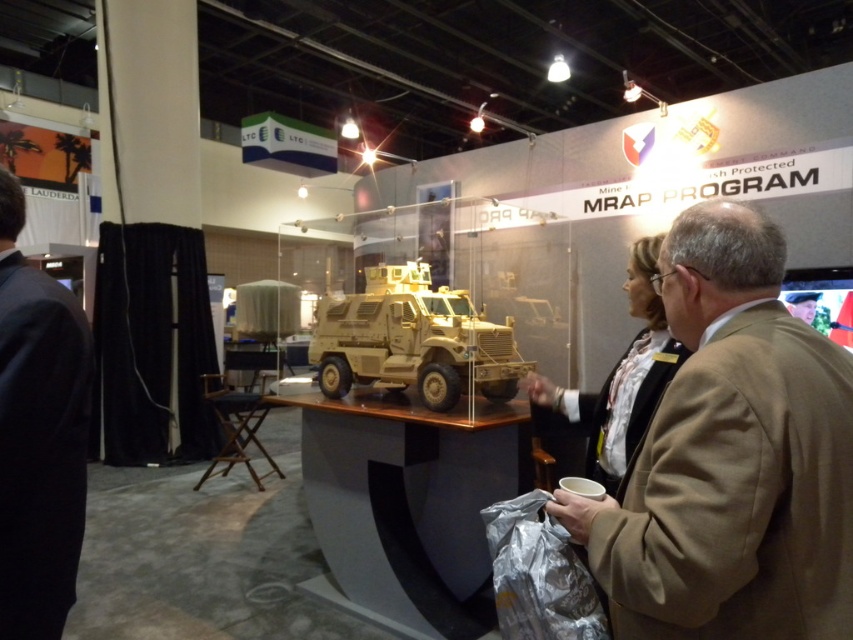
You are standing at the camera position and want to reach point (817,444). If your stride length is 28 inches, how many steps do you need to take to reach that point?

The distance between the camera and point (817,444) is 36.07 inches. Since each step covers 28 inches, you would need to take 2 steps to cover the distance, as 2 steps would cover 56 inches, which is more than enough. However, since you can adjust your last step to land precisely, you can reach the point in 2 steps.

You are an event organizer at the exhibition. You need to rearrange the seating area between the tan fabric suit at right and the black suit at left. Which person should you move first to accommodate more guests?

The tan fabric suit at right occupies less space than the black suit at left, so you should move the black suit at left first to accommodate more guests since it takes up more room.

You are a photographer at the exhibition. You want to take a photo of the black suit at left and the tan matte mrap at center so that both are fully visible. Given their height difference, which object should you position closer to the camera to ensure both are visible without cropping?

The black suit at left is much taller than the tan matte mrap at center. To ensure both are fully visible in the photo, position the black suit at left closer to the camera so its height is reduced in the frame relative to the tan matte mrap at center.